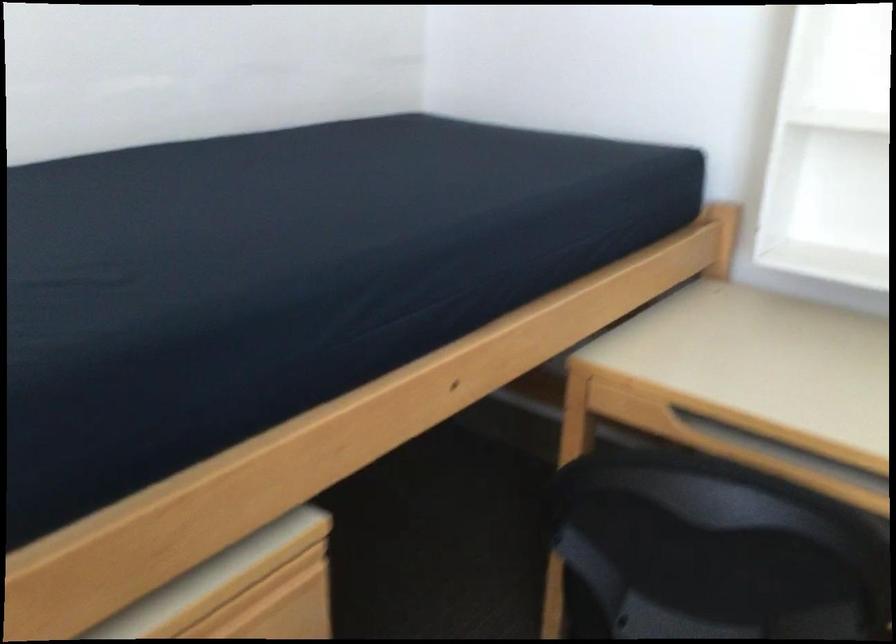
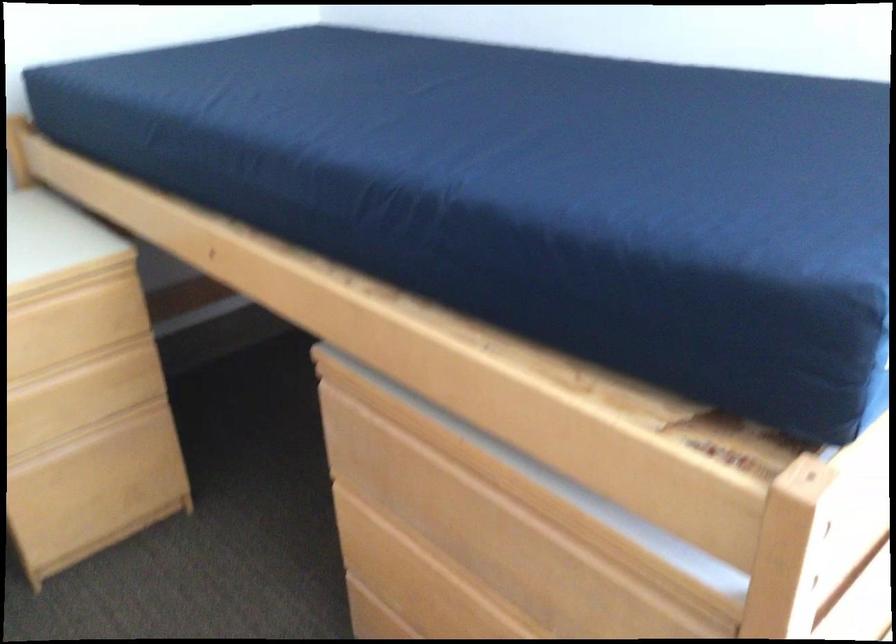
Based on the continuous images, in which direction is the camera rotating?

The camera rotated toward right-down.